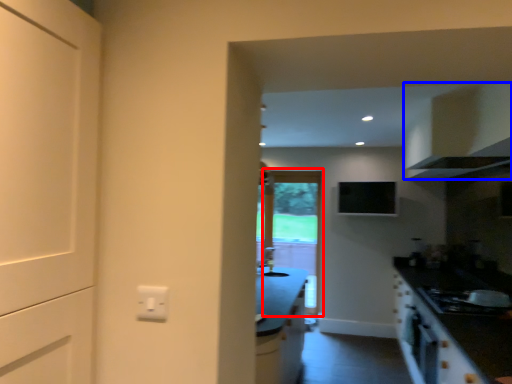
Question: Among these objects, which one is nearest to the camera, screen door (highlighted by a red box) or cabinetry (highlighted by a blue box)?

Choices:
 (A) screen door
 (B) cabinetry

Answer: (B)